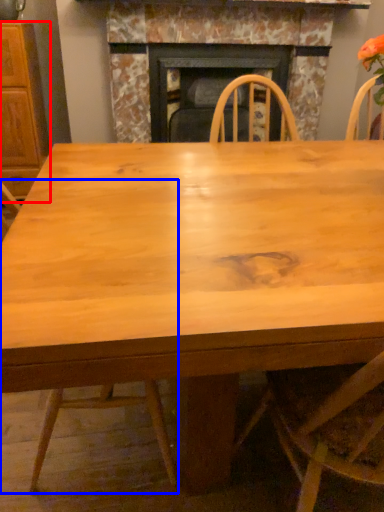
Question: Which object is further to the camera taking this photo, cabinetry (highlighted by a red box) or chair (highlighted by a blue box)?

Choices:
 (A) cabinetry
 (B) chair

Answer: (A)